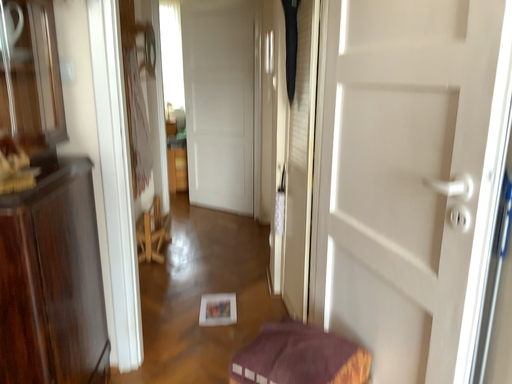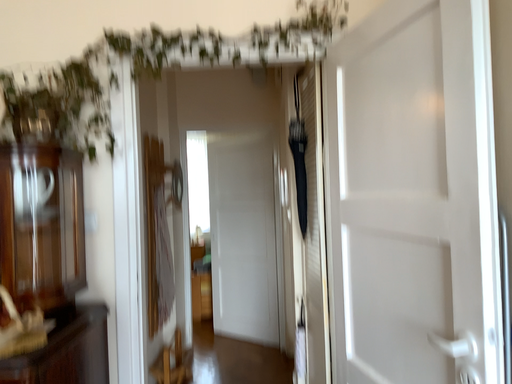
Question: How did the camera likely rotate when shooting the video?

Choices:
 (A) rotated upward
 (B) rotated downward

Answer: (A)